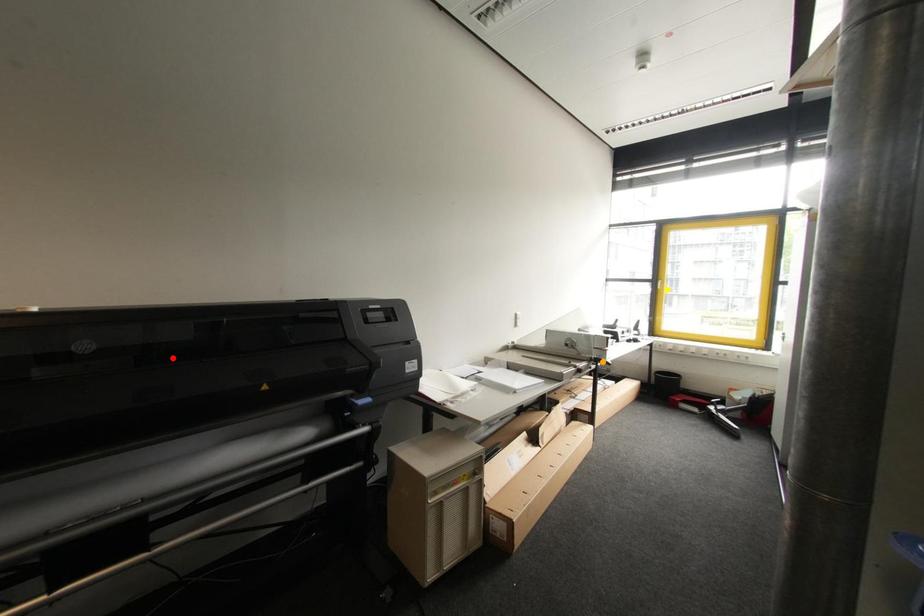
Order these from farthest to nearest:
orange point | yellow point | red point

yellow point, orange point, red point